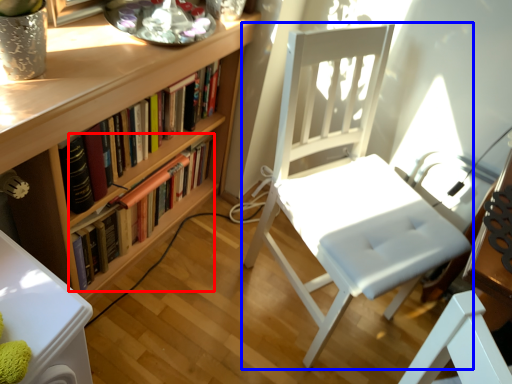
Question: Which object appears farthest to the camera in this image, book (highlighted by a red box) or chair (highlighted by a blue box)?

Choices:
 (A) book
 (B) chair

Answer: (A)